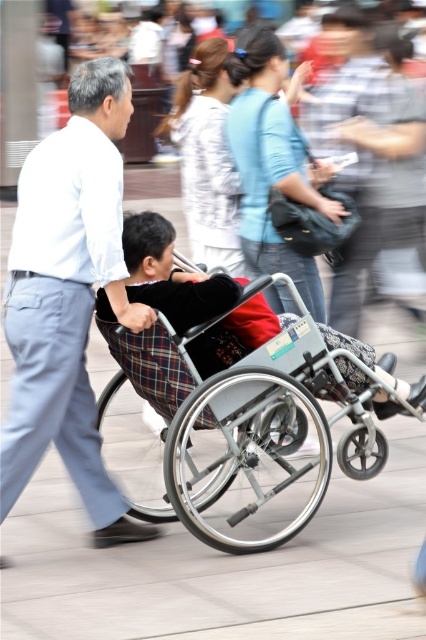
Question: Does light blue cotton shirt at left appear on the right side of metallic gray wheelchair at center?

Choices:
 (A) no
 (B) yes

Answer: (A)

Question: Is light blue cotton shirt at left positioned in front of metallic gray wheelchair at center?

Choices:
 (A) no
 (B) yes

Answer: (A)

Question: Is light blue cotton shirt at left further to the viewer compared to metallic gray wheelchair at center?

Choices:
 (A) no
 (B) yes

Answer: (B)